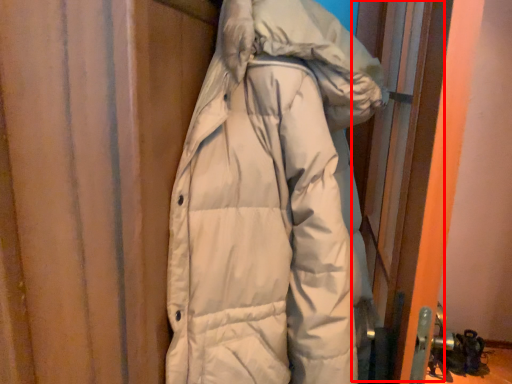
Question: From the image, what is the correct spatial relationship of screen door (annotated by the red box) in relation to jacket?

Choices:
 (A) right
 (B) left

Answer: (A)